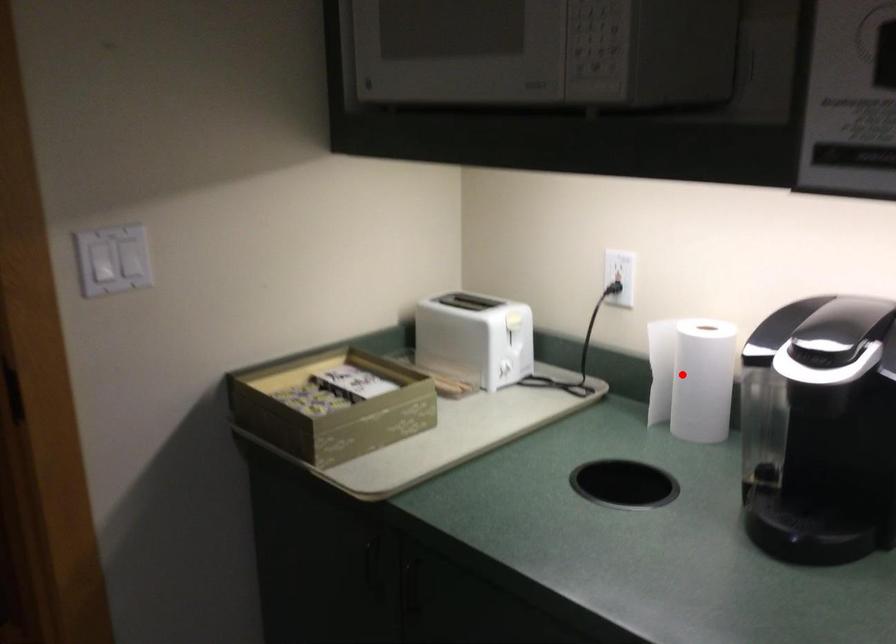
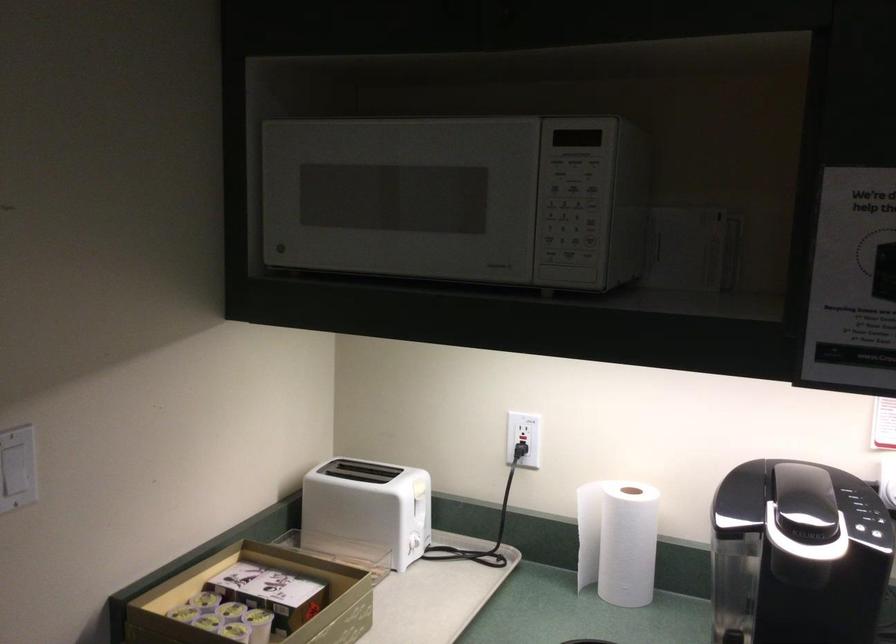
Where in the second image is the point corresponding to the highlighted location from the first image?

(617, 540)